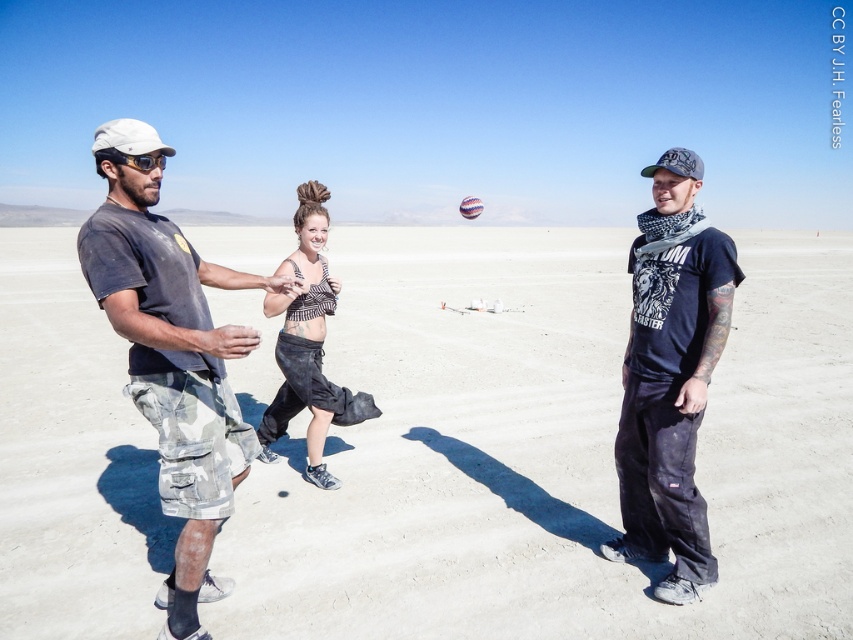
You are standing in the desert scene and want to place a small flag exactly halfway between point (62, 534) and point (329, 292). Which direction should you move from the first point to reach the halfway point?

To place the flag halfway between point (62, 534) and point (329, 292), you should move towards the point (329, 292) from the first point. The halfway point would be at coordinates calculated by averaging both x and y values of the two points.